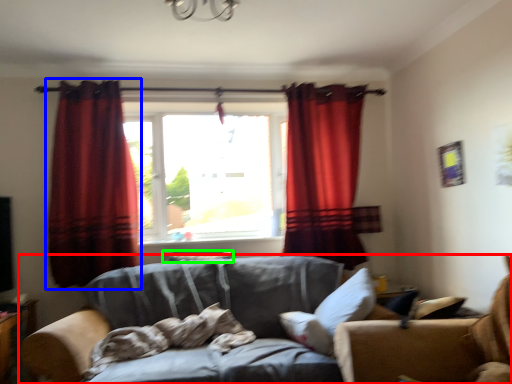
Question: Which is nearer to the studio couch (highlighted by a red box)? curtain (highlighted by a blue box) or pillow (highlighted by a green box).

Choices:
 (A) curtain
 (B) pillow

Answer: (B)